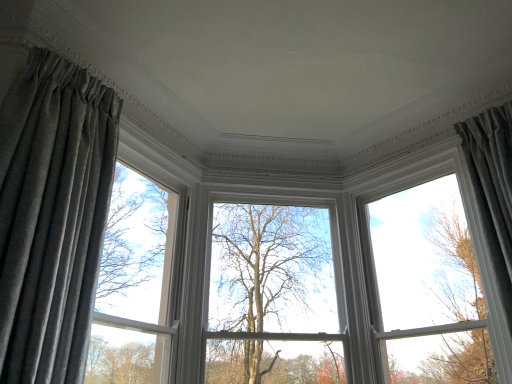
Question: From the image's perspective, relative to velvet gray curtain at left, which is counted as the 2th curtain, starting from the right, is matte gray curtain at left above or below?

Choices:
 (A) below
 (B) above

Answer: (A)

Question: In the image, is matte gray curtain at left on the left side or the right side of velvet gray curtain at left, which is counted as the 2th curtain, starting from the right?

Choices:
 (A) right
 (B) left

Answer: (A)

Question: Estimate the real-world distances between objects in this image. Which object is closer to the matte gray curtain at left?

Choices:
 (A) velvet gray curtain at left, which is counted as the 2th curtain, starting from the right
 (B) white glossy window at upper center
 (C) gray fabric curtain at right, placed as the first curtain when sorted from right to left

Answer: (A)

Question: Which object is the closest to the matte gray curtain at left?

Choices:
 (A) white glossy window at upper center
 (B) gray fabric curtain at right, the 2th curtain when ordered from left to right
 (C) velvet gray curtain at left, the first curtain positioned from the left

Answer: (C)